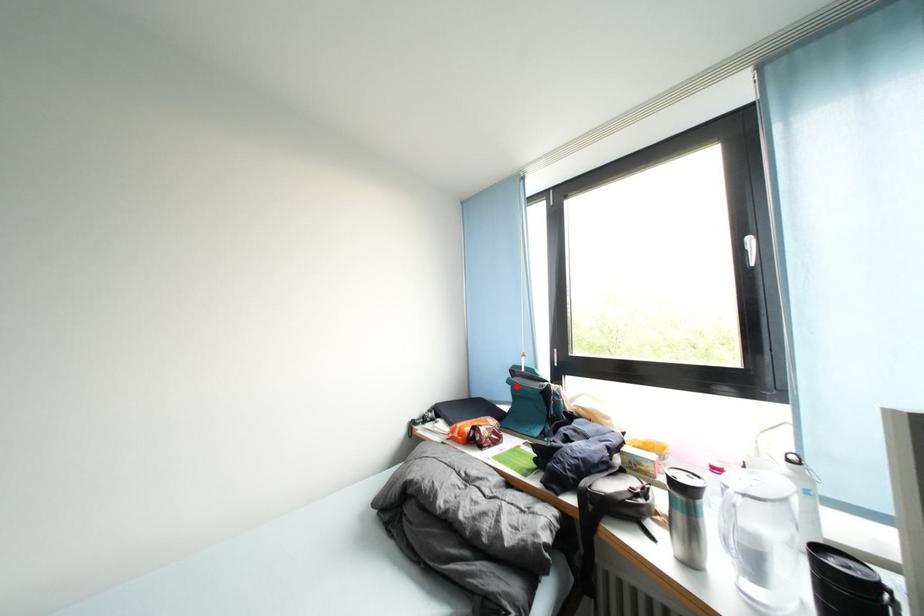
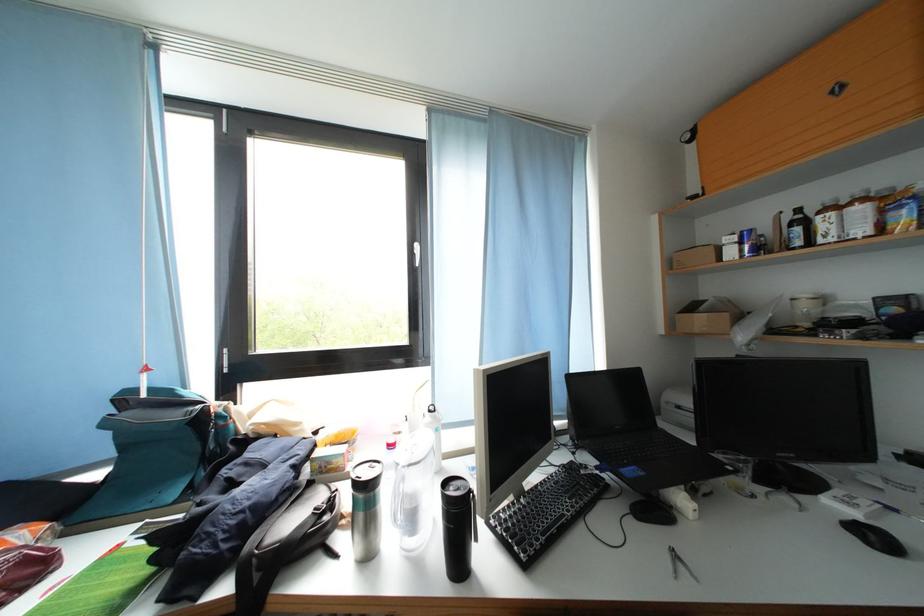
Question: A red point is marked in image1. In image2, is the corresponding 3D point closer to the camera or farther? Reply with the corresponding letter.

Choices:
 (A) The corresponding 3D point is closer.
 (B) The corresponding 3D point is farther.

Answer: (A)